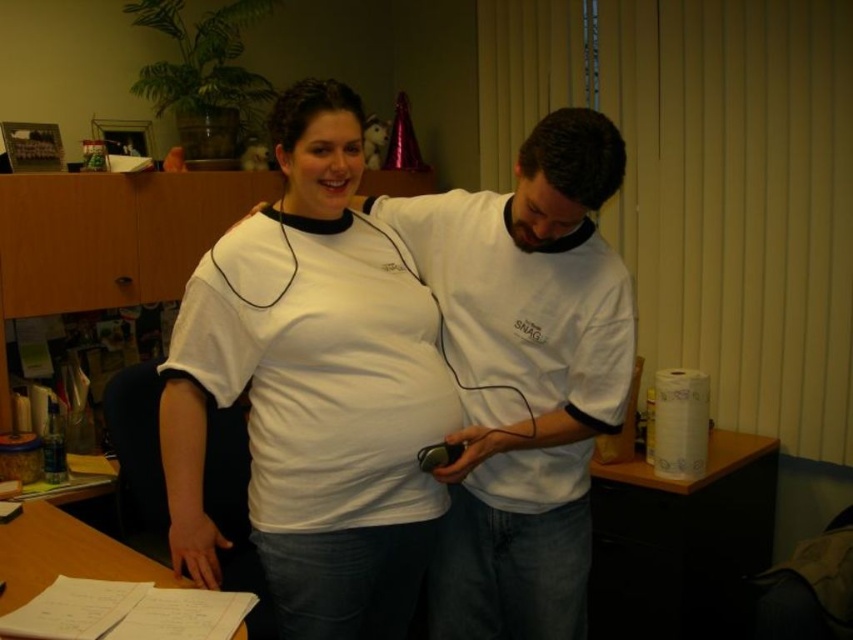
Can you confirm if white matte shirt at center is positioned below wooden desk at lower left?

Incorrect, white matte shirt at center is not positioned below wooden desk at lower left.

Image resolution: width=853 pixels, height=640 pixels. Identify the location of white matte shirt at center. (312, 388).

This screenshot has width=853, height=640. Describe the element at coordinates (312, 388) in the screenshot. I see `white matte shirt at center` at that location.

Find the location of a particular element. The image size is (853, 640). white matte shirt at center is located at coordinates (312, 388).

Can you confirm if white matte shirt at center is shorter than white paper towel at right?

No, white matte shirt at center is not shorter than white paper towel at right.

Who is positioned more to the left, white matte shirt at center or white paper towel at right?

Positioned to the left is white matte shirt at center.

The width and height of the screenshot is (853, 640). Find the location of `white matte shirt at center`. white matte shirt at center is located at coordinates (312, 388).

Can you confirm if white paper towel at right is wider than wooden desk at lower left?

Correct, the width of white paper towel at right exceeds that of wooden desk at lower left.

Is white paper towel at right to the right of wooden desk at lower left from the viewer's perspective?

Correct, you'll find white paper towel at right to the right of wooden desk at lower left.

Between point (706, 561) and point (44, 554), which one is positioned behind?

Positioned behind is point (706, 561).

Where is `white paper towel at right`? white paper towel at right is located at coordinates (680, 541).